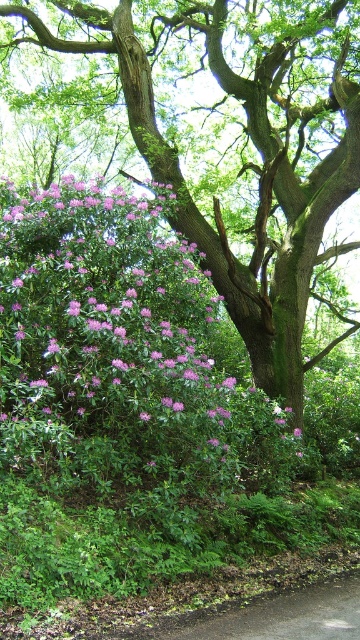
Looking at this image, is green rough bark tree at upper center in front of pink matte flower at center?

No, it is not.

Is point (358, 113) closer to viewer compared to point (299, 433)?

No, (358, 113) is behind (299, 433).

Find the location of `green rough bark tree at upper center`. green rough bark tree at upper center is located at coordinates (258, 189).